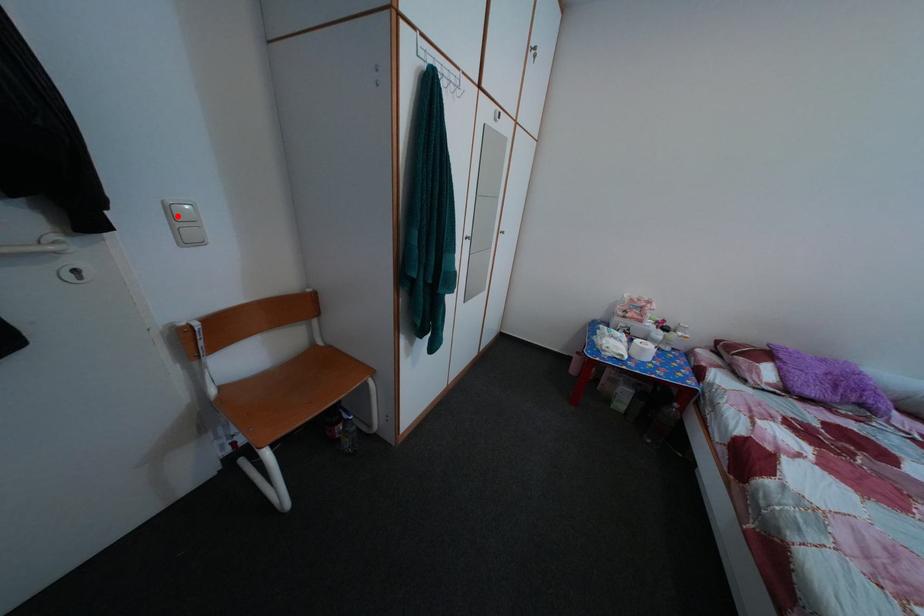
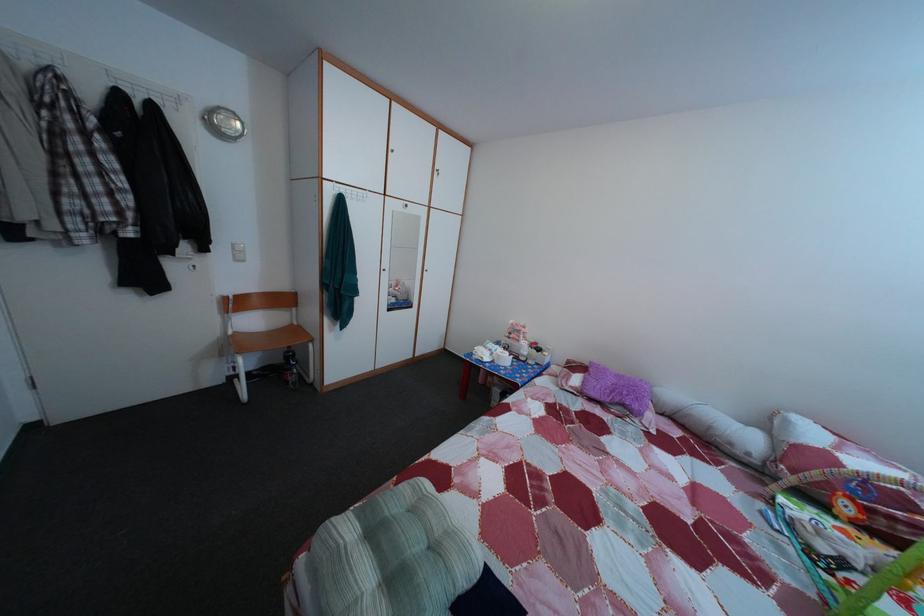
The point at the highlighted location is marked in the first image. Where is the corresponding point in the second image?

(242, 254)